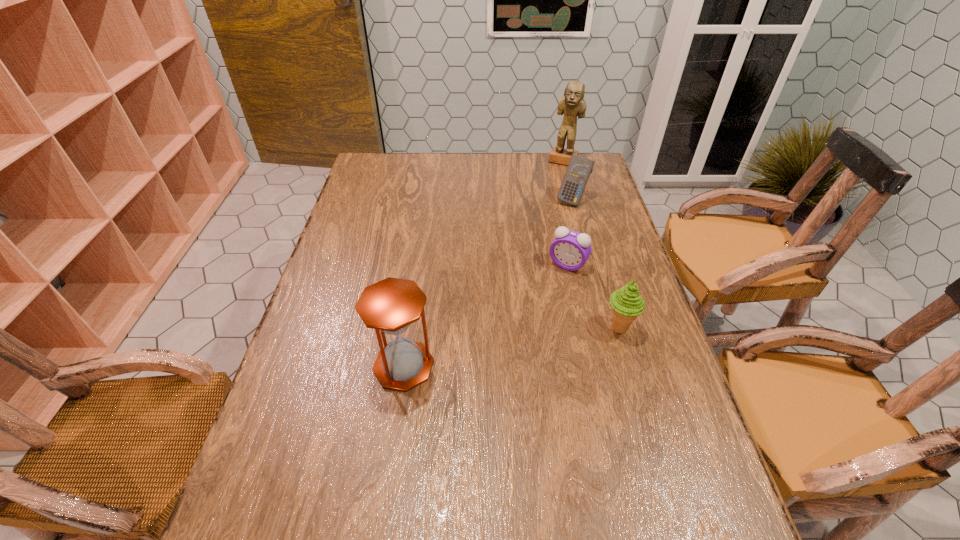
Find the location of a particular element. This screenshot has height=540, width=960. icecream present at the right edge is located at coordinates (627, 304).

Where is `calculator positioned at the right edge`? calculator positioned at the right edge is located at coordinates (579, 168).

Locate an element on the screen. Image resolution: width=960 pixels, height=540 pixels. figurine located in the right edge section of the desktop is located at coordinates (572, 104).

Where is `alarm clock at the right edge`? The height and width of the screenshot is (540, 960). alarm clock at the right edge is located at coordinates (570, 250).

At what (x,y) coordinates should I click in order to perform the action: click on object at the far right corner. Please return your answer as a coordinate pair (x, y). The image size is (960, 540). Looking at the image, I should click on (572, 104).

You are a GUI agent. You are given a task and a screenshot of the screen. Output one action in this format:
    pyautogui.click(x=<x>, y=<y>)
    Task: Click on the blank space at the far edge of the desktop
    This screenshot has height=540, width=960.
    Given the screenshot: What is the action you would take?
    pyautogui.click(x=488, y=177)

Image resolution: width=960 pixels, height=540 pixels. Find the location of `blank space at the near edge of the desktop`. blank space at the near edge of the desktop is located at coordinates (618, 472).

The height and width of the screenshot is (540, 960). In the image, there is a desktop. In order to click on free region at the left edge in this screenshot , I will do `click(359, 258)`.

At what (x,y) coordinates should I click in order to perform the action: click on vacant region at the right edge of the desktop. Please return your answer as a coordinate pair (x, y). The image size is (960, 540). Looking at the image, I should click on (583, 227).

The image size is (960, 540). In order to click on vacant area that lies between the fourth shortest object and the tallest object in this screenshot , I will do `click(484, 264)`.